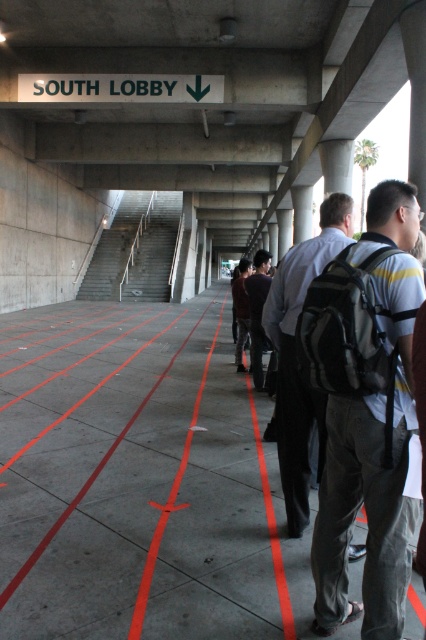
You are standing at the starting point in the corridor and see two points marked on the floor labeled as point [13,388] and point [135,637]. If you want to reach the SOUTH LOBBY by following the red lines on the floor, which point should you step on first?

You should step on point [135,637] first because point [13,388] is behind it, meaning point [135,637] is closer to your starting position and the direction towards the SOUTH LOBBY.

You are standing at the starting point of the corridor and see the point marked at coordinates (296, 355). What object is located there?

The object at point (296, 355) is a matte black backpack at right.

You are a delivery robot with a width of 0.8 meters. You need to navigate through the corridor and reach the SOUTH LOBBY. There is a matte black backpack at right and black fabric pants at center in your path. Can you pass through the space between them without touching either?

The distance between the matte black backpack at right and black fabric pants at center is 1.09 meters. Since your robot is 0.8 meters wide, you can safely pass through the space between them without touching either object.